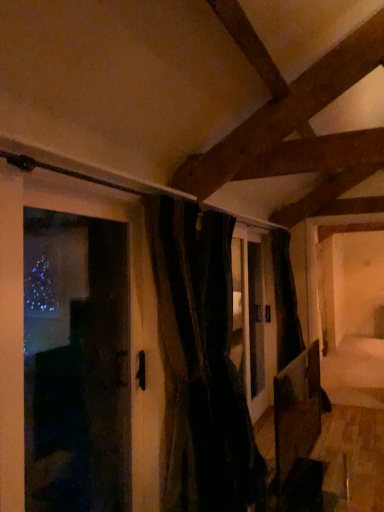
You are a GUI agent. You are given a task and a screenshot of the screen. Output one action in this format:
    pyautogui.click(x=<x>, y=<y>)
    Task: Click on the velvet dark green curtain at center
    
    Given the screenshot: What is the action you would take?
    pyautogui.click(x=202, y=362)

This screenshot has width=384, height=512. What do you see at coordinates (202, 362) in the screenshot?
I see `velvet dark green curtain at center` at bounding box center [202, 362].

The height and width of the screenshot is (512, 384). Find the location of `velvet dark green curtain at center`. velvet dark green curtain at center is located at coordinates (202, 362).